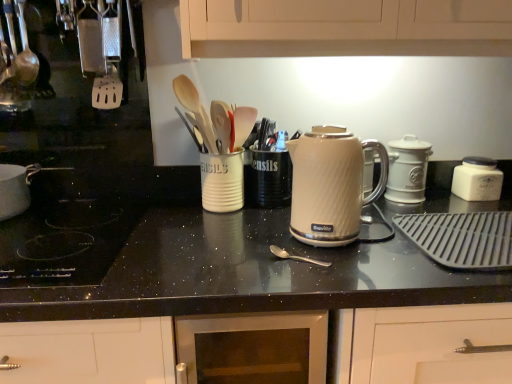
Identify the location of vacant area that is in front of white ribbed mug at center. (224, 227).